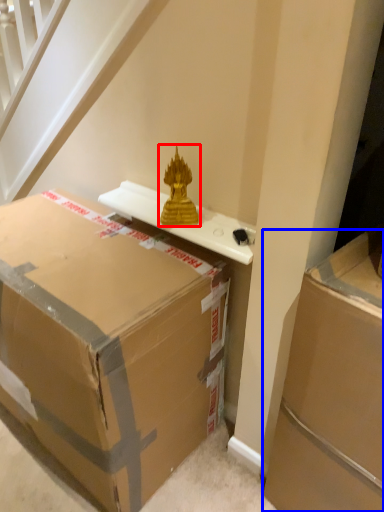
Question: Which object is closer to the camera taking this photo, sculpture (highlighted by a red box) or box (highlighted by a blue box)?

Choices:
 (A) sculpture
 (B) box

Answer: (B)